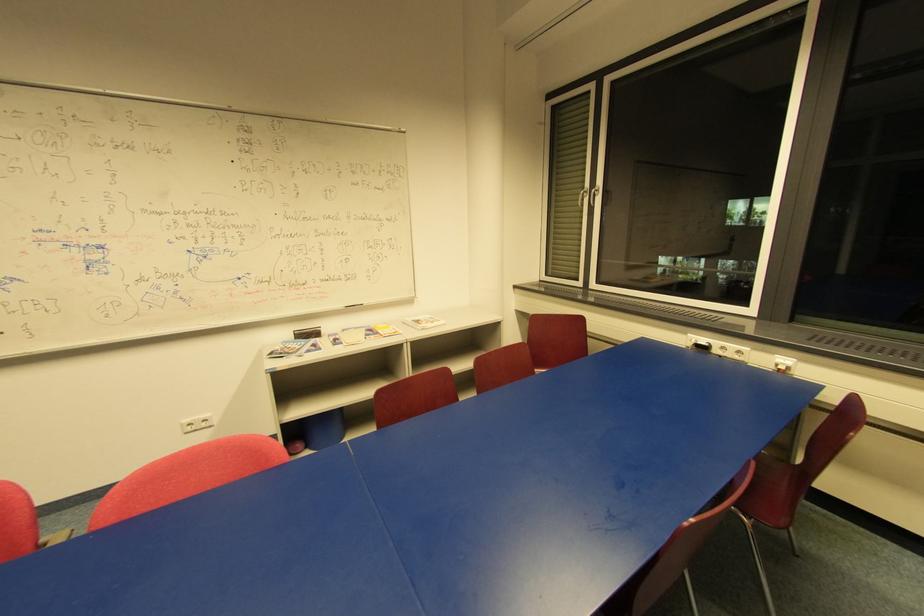
Locate an element on the screen. The width and height of the screenshot is (924, 616). white window handle is located at coordinates (592, 195).